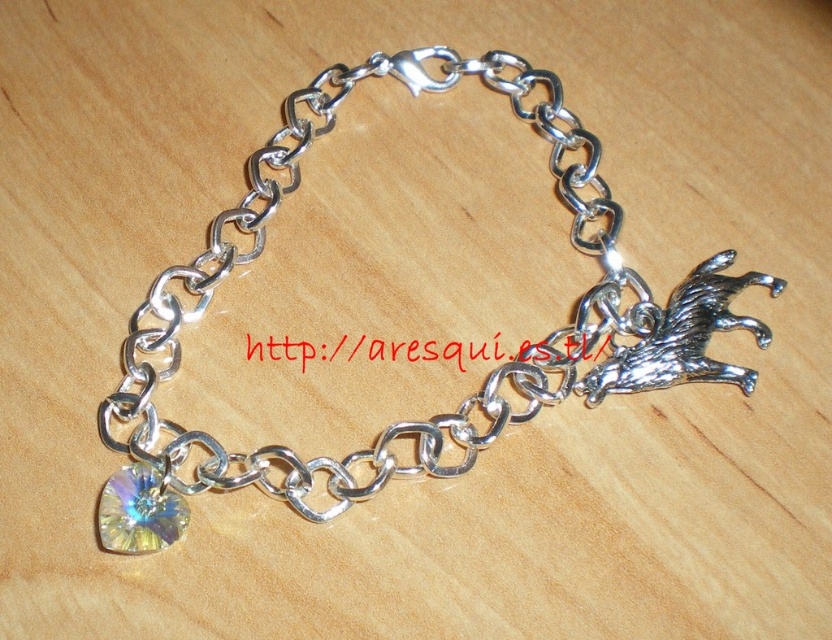
You are holding a silver metallic chain at center and want to place a new charm on it. The rainbow crystal charm at bottom left is currently attached. Can you determine which charm is closer to you?

The silver metallic chain at center is further to the viewer than rainbow crystal charm at bottom left, so the rainbow crystal charm at bottom left is closer to you.

You are trying to locate the silver metallic chain at center and rainbow crystal charm at bottom left on the bracelet. Based on the scene description, which object is positioned to the left of the other?

The rainbow crystal charm at bottom left is positioned to the left of the silver metallic chain at center.